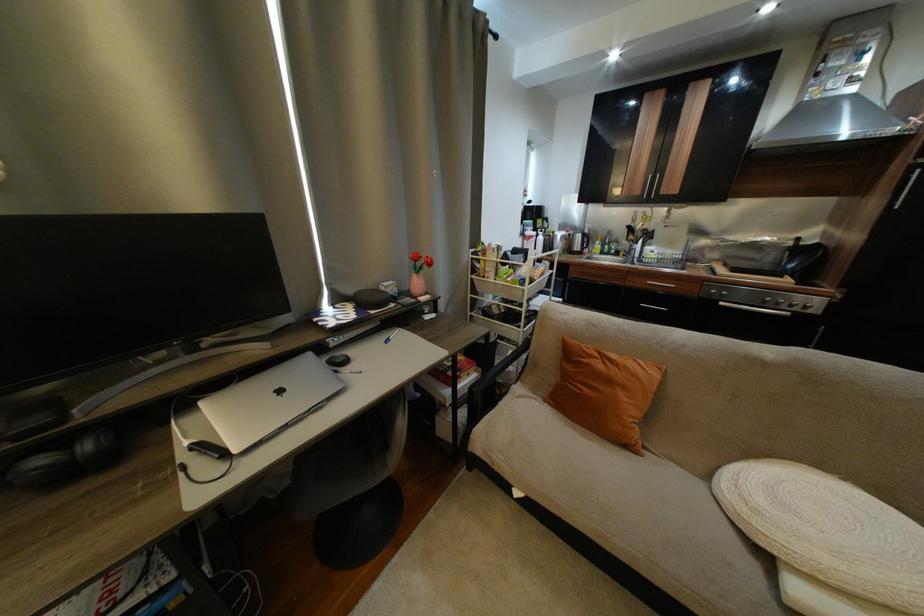
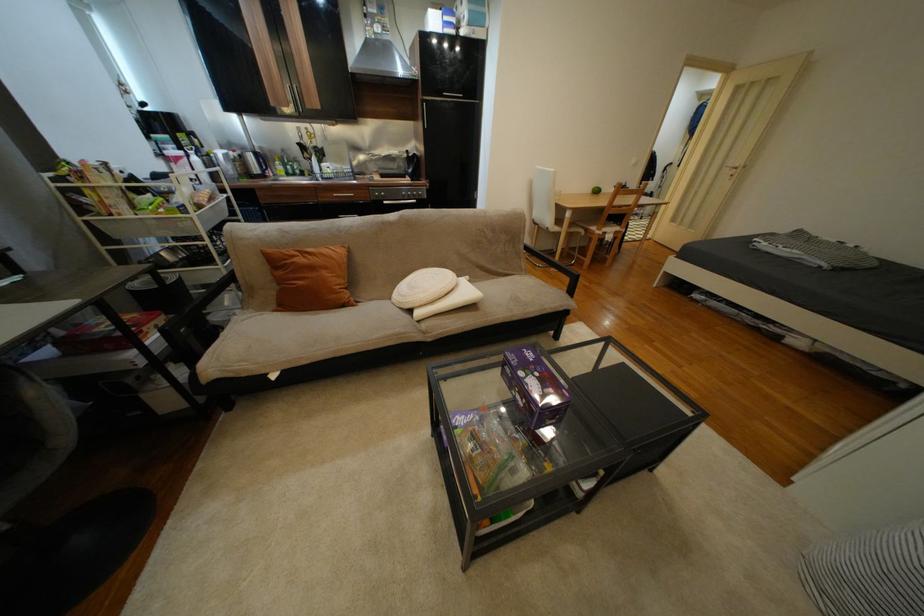
Where in the second image is the point corresponding to point (601, 358) from the first image?

(301, 257)